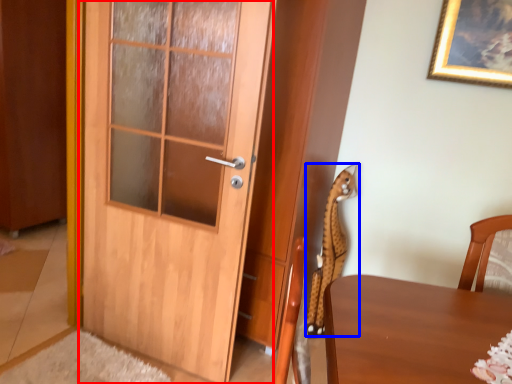
Question: Which object appears closest to the camera in this image, door (highlighted by a red box) or animal (highlighted by a blue box)?

Choices:
 (A) door
 (B) animal

Answer: (A)